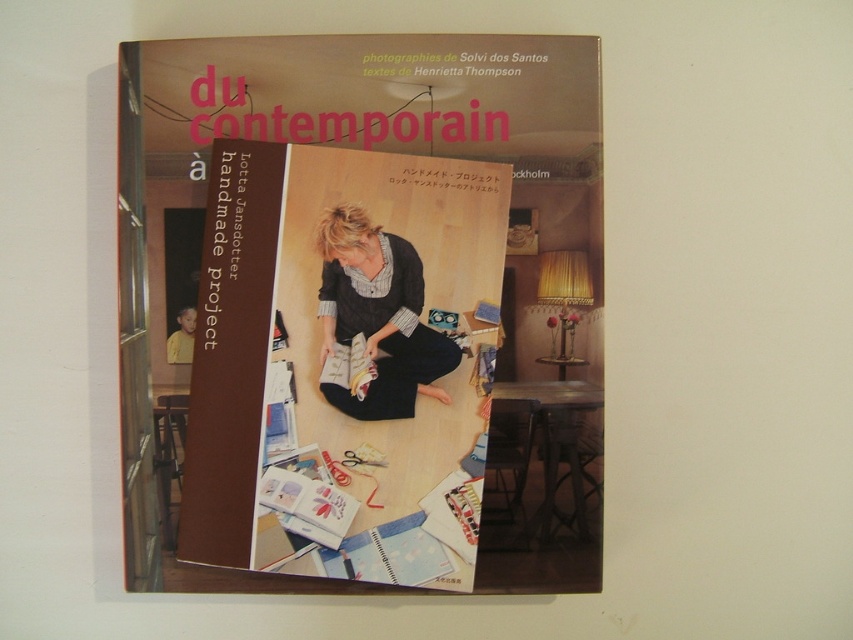
Who is shorter, matte black book at center or matte black dress at center?

matte black dress at center is shorter.

Is point (303, 556) in front of point (379, 246)?

Yes.

Where is `matte black book at center`? matte black book at center is located at coordinates (343, 364).